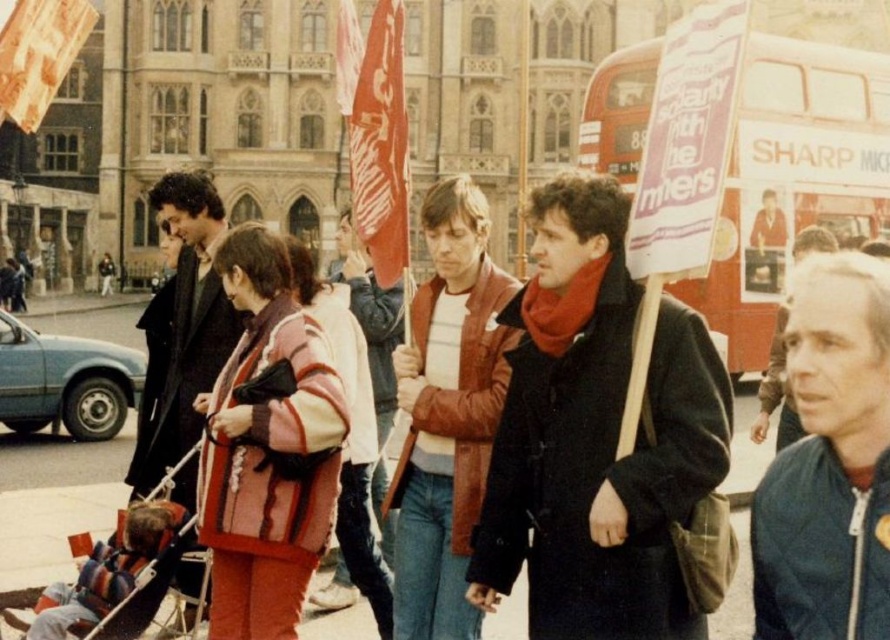
You are standing in the city square and see the matte black coat at center. If you want to reach it in 10 seconds, what is the minimum speed you need to walk at in miles per hour?

To cover 229.53 feet in 10 seconds, you would need to walk at a minimum speed of approximately 2.9 miles per hour.

You are a photographer trying to capture a clear shot of the dark brown leather coat at left without the matte black coat at center blocking it. What should you do?

Move your position to the right side so that the dark brown leather coat at left becomes visible behind the matte black coat at center, which is currently in front of it.